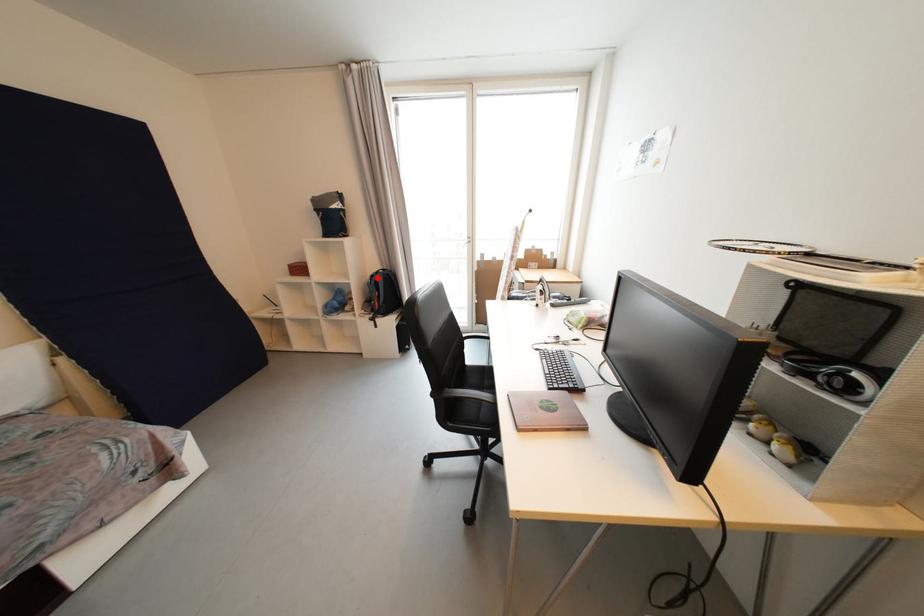
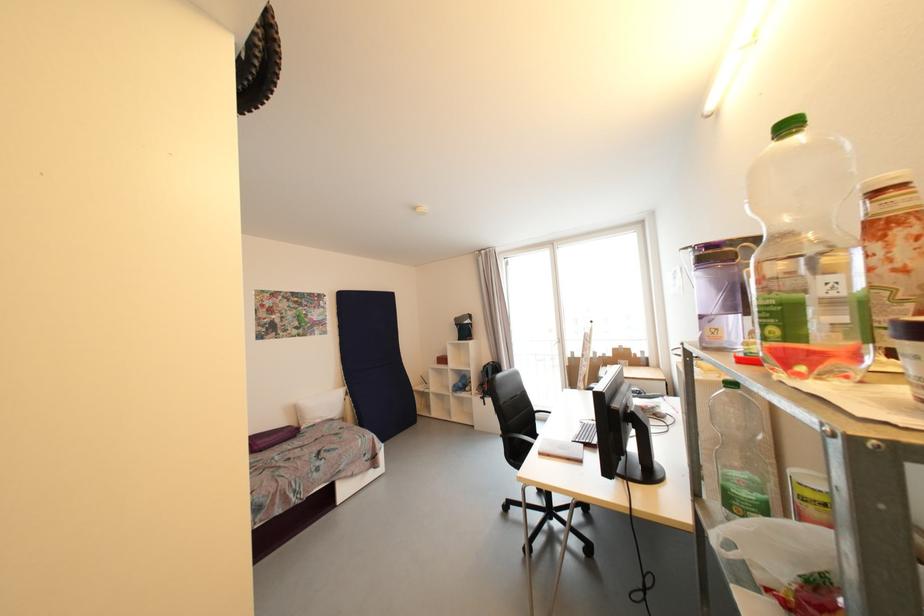
Question: A red point is marked in image1. In image2, is the corresponding 3D point closer to the camera or farther? Reply with the corresponding letter.

Choices:
 (A) The corresponding 3D point is closer.
 (B) The corresponding 3D point is farther.

Answer: (B)